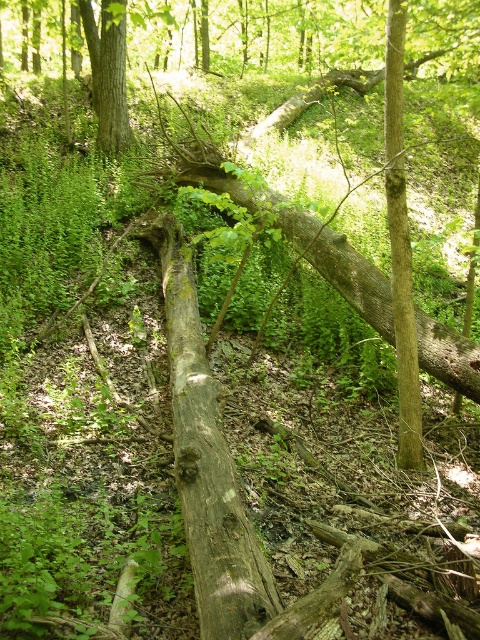
Does wooden log at center have a greater width compared to smooth brown tree trunk at upper left?

Indeed, wooden log at center has a greater width compared to smooth brown tree trunk at upper left.

Based on the photo, is wooden log at center bigger than smooth brown tree trunk at upper left?

Yes.

The width and height of the screenshot is (480, 640). Identify the location of wooden log at center. (206, 460).

At what (x,y) coordinates should I click in order to perform the action: click on wooden log at center. Please return your answer as a coordinate pair (x, y). Looking at the image, I should click on (206, 460).